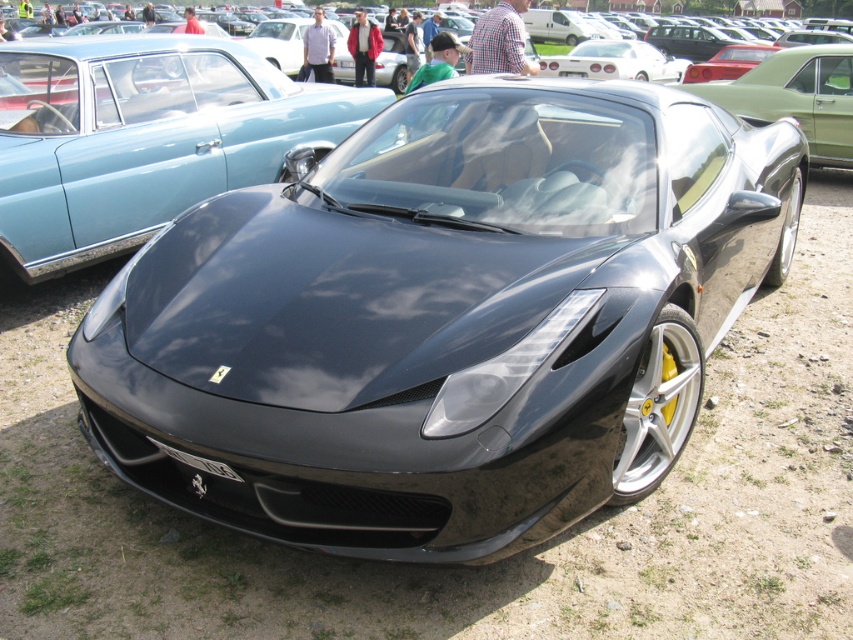
The height and width of the screenshot is (640, 853). Describe the element at coordinates (142, 136) in the screenshot. I see `matte blue sedan at center` at that location.

I want to click on matte blue sedan at center, so (x=142, y=136).